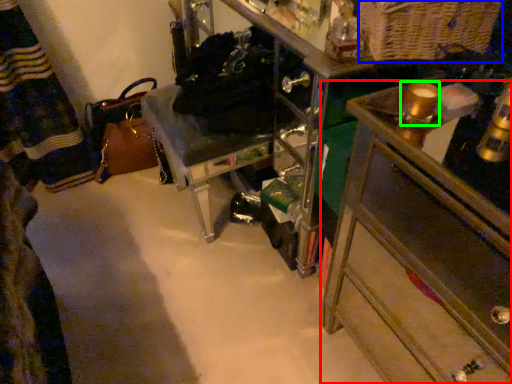
Question: Considering the real-world distances, which object is closest to chest of drawers (highlighted by a red box)? basket (highlighted by a blue box) or beverage (highlighted by a green box).

Choices:
 (A) basket
 (B) beverage

Answer: (B)